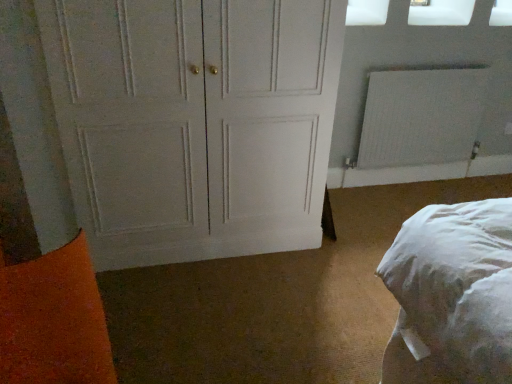
Question: Is white textured radiator at upper right facing towards white painted wood door at center?

Choices:
 (A) no
 (B) yes

Answer: (A)

Question: Is white textured radiator at upper right at the right side of white painted wood door at center?

Choices:
 (A) no
 (B) yes

Answer: (B)

Question: Can you confirm if white textured radiator at upper right is taller than white painted wood door at center?

Choices:
 (A) no
 (B) yes

Answer: (A)

Question: Is white textured radiator at upper right bigger than white painted wood door at center?

Choices:
 (A) yes
 (B) no

Answer: (B)

Question: Considering the relative sizes of white textured radiator at upper right and white painted wood door at center in the image provided, is white textured radiator at upper right smaller than white painted wood door at center?

Choices:
 (A) yes
 (B) no

Answer: (A)

Question: Would you say white textured radiator at upper right is inside or outside white matte window screen at upper right, which appears as the second window screen when viewed from the right?

Choices:
 (A) outside
 (B) inside

Answer: (A)

Question: In terms of size, does white textured radiator at upper right appear bigger or smaller than white matte window screen at upper right, which appears as the second window screen when viewed from the right?

Choices:
 (A) big
 (B) small

Answer: (A)

Question: Considering the relative positions of white textured radiator at upper right and white matte window screen at upper right, which appears as the second window screen when viewed from the right, in the image provided, is white textured radiator at upper right to the left or to the right of white matte window screen at upper right, which appears as the second window screen when viewed from the right,?

Choices:
 (A) left
 (B) right

Answer: (B)

Question: From the image's perspective, is white textured radiator at upper right above or below white matte window screen at upper right, which appears as the second window screen when viewed from the right?

Choices:
 (A) below
 (B) above

Answer: (A)

Question: Is white matte window screen at upper right, the first window screen from the left, spatially inside white painted wood door at center, or outside of it?

Choices:
 (A) outside
 (B) inside

Answer: (A)

Question: From the image's perspective, is white matte window screen at upper right, which appears as the second window screen when viewed from the right, located above or below white painted wood door at center?

Choices:
 (A) above
 (B) below

Answer: (A)

Question: Is point (358, 23) positioned closer to the camera than point (88, 124)?

Choices:
 (A) closer
 (B) farther

Answer: (B)

Question: In terms of height, does white matte window screen at upper right, the first window screen from the left, look taller or shorter compared to white painted wood door at center?

Choices:
 (A) short
 (B) tall

Answer: (A)

Question: Considering the positions of point (382, 8) and point (412, 86), is point (382, 8) closer or farther from the camera than point (412, 86)?

Choices:
 (A) farther
 (B) closer

Answer: (B)

Question: In terms of height, does white matte window screen at upper right, which appears as the second window screen when viewed from the right, look taller or shorter compared to white textured radiator at upper right?

Choices:
 (A) short
 (B) tall

Answer: (A)